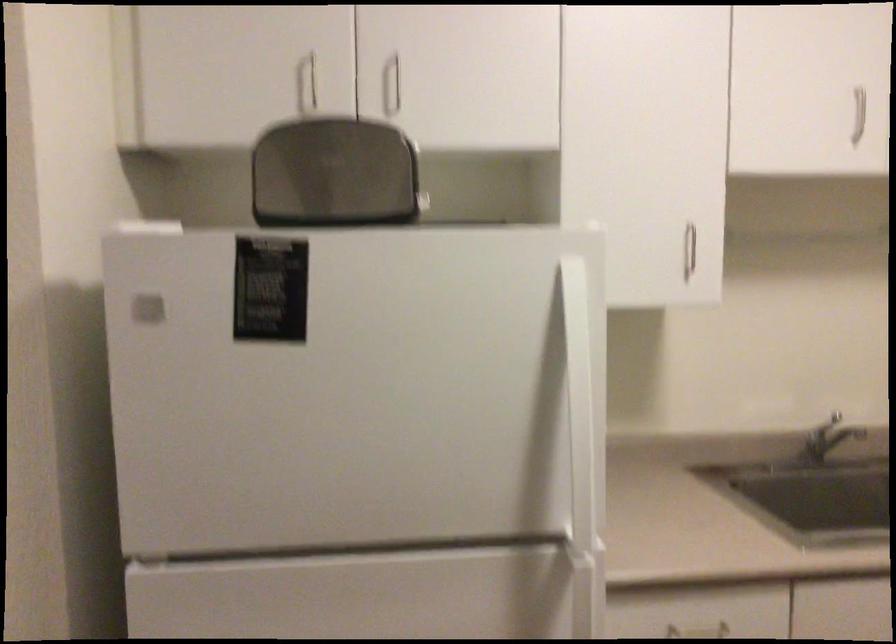
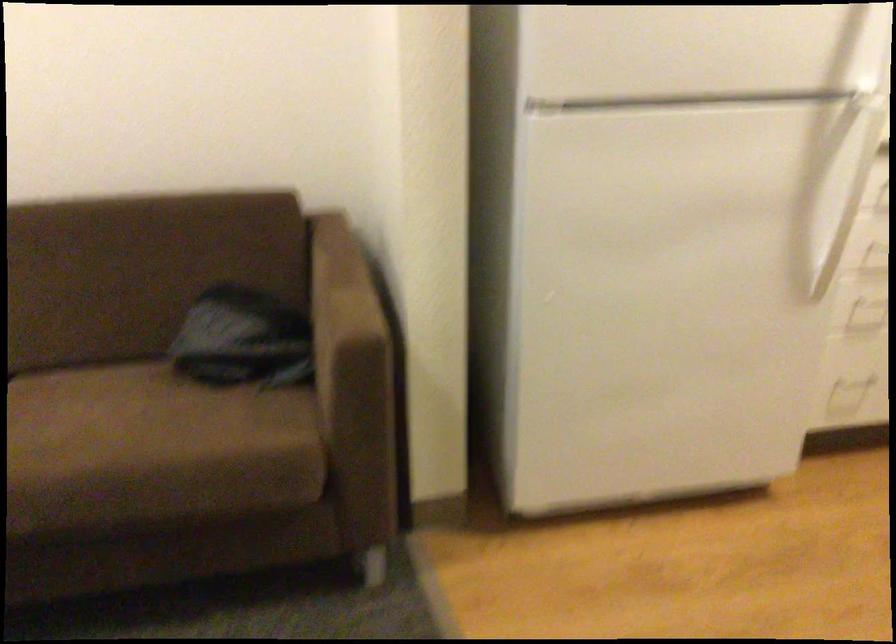
What movement of the cameraman would produce the second image?

The cameraman moved toward left, backward.